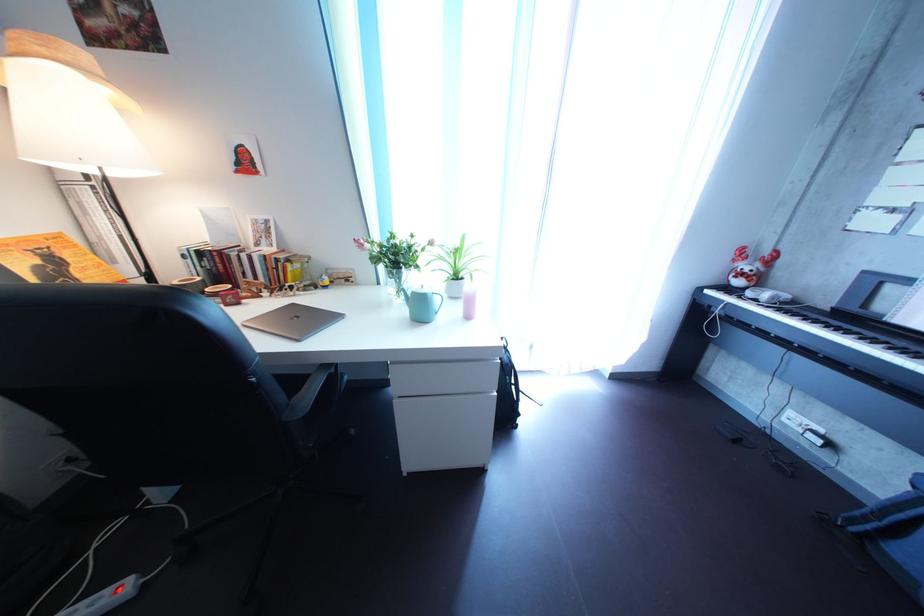
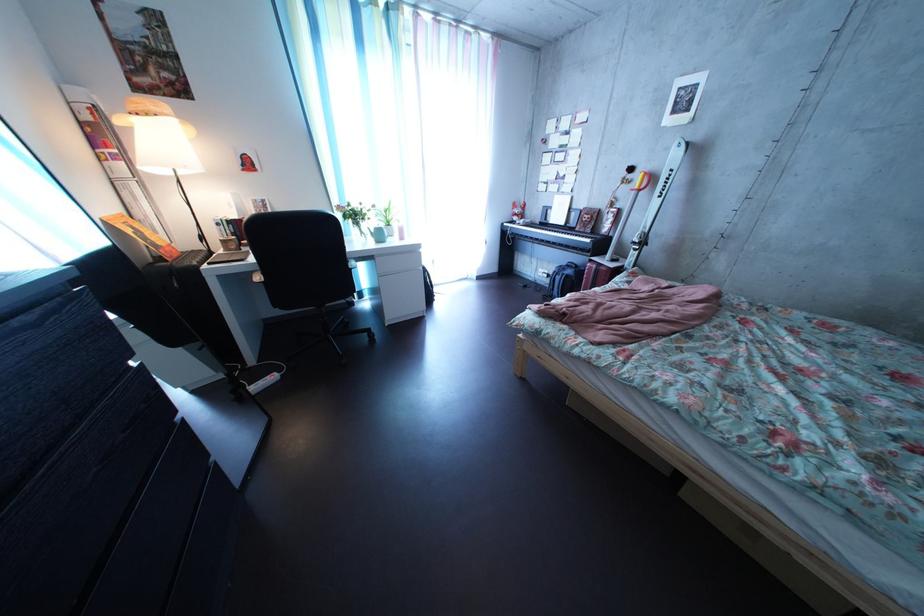
The point at (793,395) is marked in the first image. Where is the corresponding point in the second image?

(550, 269)